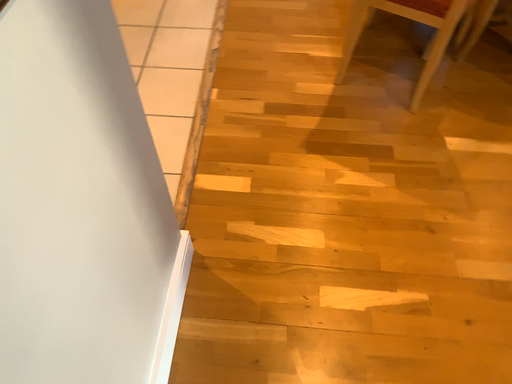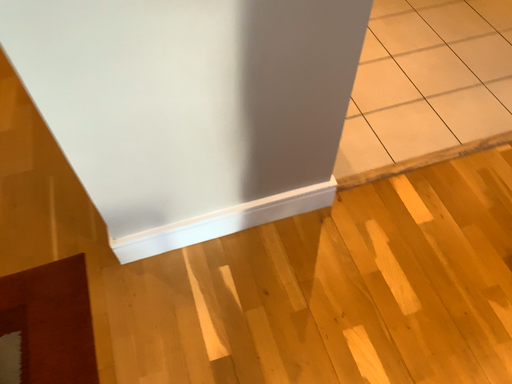
Question: How did the camera likely rotate when shooting the video?

Choices:
 (A) rotated right
 (B) rotated left

Answer: (B)